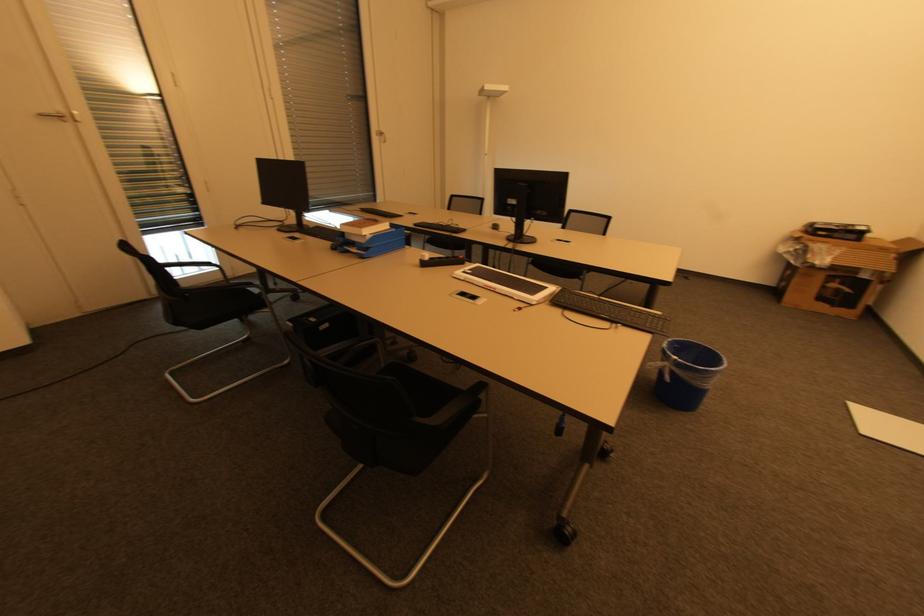
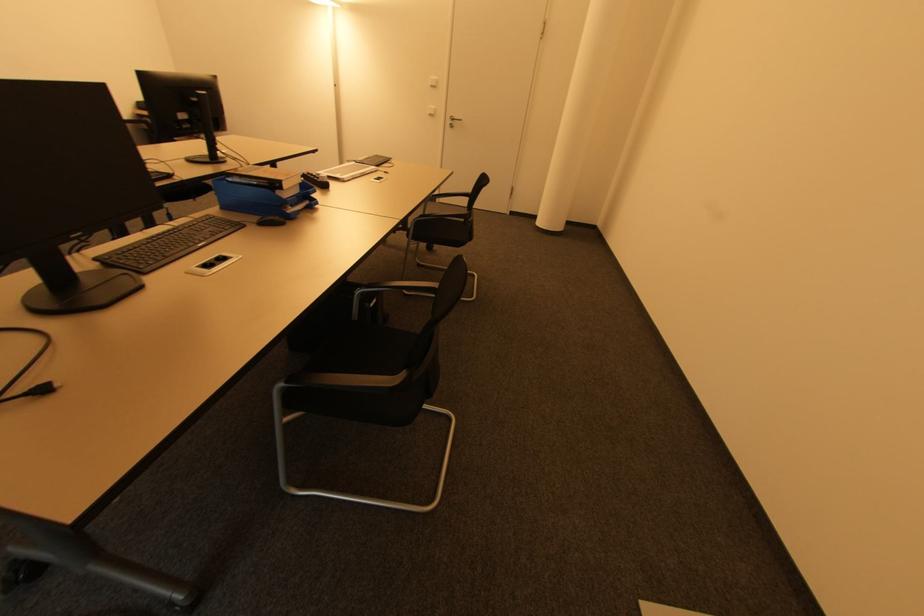
Locate, in the second image, the point that corresponds to (x=359, y=249) in the first image.

(294, 207)